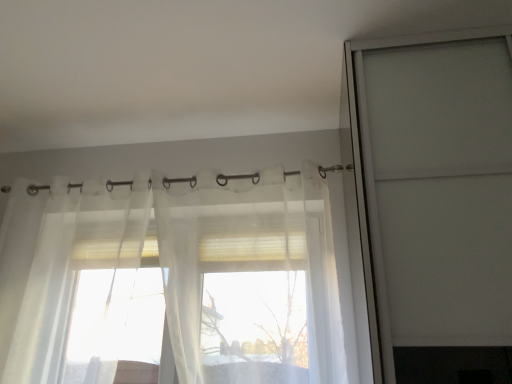
The width and height of the screenshot is (512, 384). Describe the element at coordinates (374, 179) in the screenshot. I see `transparent glass screen door at upper right` at that location.

What do you see at coordinates (189, 251) in the screenshot? I see `sheer white curtain at center` at bounding box center [189, 251].

Where is `translucent fabric curtain at upper center`? Image resolution: width=512 pixels, height=384 pixels. translucent fabric curtain at upper center is located at coordinates (332, 169).

Based on the photo, which point is more forward, (x=236, y=176) or (x=355, y=56)?

Point (x=355, y=56)

Does translucent fabric curtain at upper center turn towards transparent glass screen door at upper right?

No, translucent fabric curtain at upper center is not turned towards transparent glass screen door at upper right.

Based on their sizes in the image, would you say translucent fabric curtain at upper center is bigger or smaller than transparent glass screen door at upper right?

translucent fabric curtain at upper center is smaller than transparent glass screen door at upper right.

Can you tell me how much translucent fabric curtain at upper center and transparent glass screen door at upper right differ in facing direction?

The facing directions of translucent fabric curtain at upper center and transparent glass screen door at upper right are 0.54 degrees apart.

Measure the distance between transparent glass screen door at upper right and sheer white curtain at center.

transparent glass screen door at upper right and sheer white curtain at center are 32.99 inches apart.

Is transparent glass screen door at upper right bigger than sheer white curtain at center?

Correct, transparent glass screen door at upper right is larger in size than sheer white curtain at center.

Does transparent glass screen door at upper right touch sheer white curtain at center?

No, transparent glass screen door at upper right is not next to sheer white curtain at center.

Does transparent glass screen door at upper right contain sheer white curtain at center?

Definitely not — sheer white curtain at center is not inside transparent glass screen door at upper right.

At what (x,y) coordinates should I click in order to perform the action: click on curtain lying below the translucent fabric curtain at upper center (from the image's perspective). Please return your answer as a coordinate pair (x, y). This screenshot has height=384, width=512. Looking at the image, I should click on (189, 251).

Would you say translucent fabric curtain at upper center is inside or outside sheer white curtain at center?

The correct answer is: inside.

Is translucent fabric curtain at upper center turned away from sheer white curtain at center?

Correct, translucent fabric curtain at upper center is looking away from sheer white curtain at center.

Between point (10, 188) and point (303, 249), which one is positioned behind?

Point (10, 188)

Is sheer white curtain at center aimed at translucent fabric curtain at upper center?

No, sheer white curtain at center is not facing towards translucent fabric curtain at upper center.

Considering the relative sizes of sheer white curtain at center and translucent fabric curtain at upper center in the image provided, is sheer white curtain at center smaller than translucent fabric curtain at upper center?

No, sheer white curtain at center is not smaller than translucent fabric curtain at upper center.

Is sheer white curtain at center inside the boundaries of translucent fabric curtain at upper center, or outside?

sheer white curtain at center is spatially situated outside translucent fabric curtain at upper center.

Which of these two, sheer white curtain at center or translucent fabric curtain at upper center, is thinner?

translucent fabric curtain at upper center.

Which is closer, (358, 175) or (72, 185)?

Positioned in front is point (358, 175).

Who is bigger, transparent glass screen door at upper right or translucent fabric curtain at upper center?

Bigger between the two is transparent glass screen door at upper right.

Locate an element on the screen. clothesline behind the transparent glass screen door at upper right is located at coordinates (332, 169).

Is transparent glass screen door at upper right looking in the opposite direction of translucent fabric curtain at upper center?

That's not correct — transparent glass screen door at upper right is not looking away from translucent fabric curtain at upper center.

Is sheer white curtain at center wider or thinner than transparent glass screen door at upper right?

Considering their sizes, sheer white curtain at center looks slimmer than transparent glass screen door at upper right.

Is the depth of sheer white curtain at center less than that of transparent glass screen door at upper right?

No, sheer white curtain at center is further to the viewer.

Is sheer white curtain at center next to transparent glass screen door at upper right?

sheer white curtain at center and transparent glass screen door at upper right are not in contact.

Which point is more distant from viewer, (85, 196) or (375, 317)?

Positioned behind is point (85, 196).

The width and height of the screenshot is (512, 384). I want to click on screen door below the translucent fabric curtain at upper center (from a real-world perspective), so click(374, 179).

Identify the location of curtain behind the transparent glass screen door at upper right. coord(189,251).

From the image, which object appears to be nearer to translucent fabric curtain at upper center, transparent glass screen door at upper right or sheer white curtain at center?

Among the two, transparent glass screen door at upper right is located nearer to translucent fabric curtain at upper center.

Estimate the real-world distances between objects in this image. Which object is further from transparent glass screen door at upper right, sheer white curtain at center or translucent fabric curtain at upper center?

sheer white curtain at center.

Looking at the image, which one is located further to sheer white curtain at center, translucent fabric curtain at upper center or transparent glass screen door at upper right?

transparent glass screen door at upper right is positioned further to the anchor sheer white curtain at center.

Based on their spatial positions, is transparent glass screen door at upper right or translucent fabric curtain at upper center closer to sheer white curtain at center?

translucent fabric curtain at upper center lies closer to sheer white curtain at center than the other object.

Estimate the real-world distances between objects in this image. Which object is closer to translucent fabric curtain at upper center, sheer white curtain at center or transparent glass screen door at upper right?

transparent glass screen door at upper right is closer to translucent fabric curtain at upper center.

From the image, which object appears to be nearer to transparent glass screen door at upper right, translucent fabric curtain at upper center or sheer white curtain at center?

translucent fabric curtain at upper center is closer to transparent glass screen door at upper right.

Image resolution: width=512 pixels, height=384 pixels. Identify the location of curtain between translucent fabric curtain at upper center and transparent glass screen door at upper right. (189, 251).